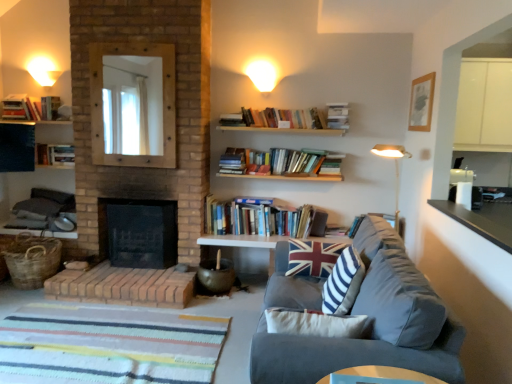
Question: Which direction should I rotate to look at striped fabric pillow at center, placed as the second pillow when sorted from back to front?

Choices:
 (A) left
 (B) right

Answer: (B)

Question: From the image's perspective, is white matte wall sconce at upper left, which appears as the 2th lighting when viewed from the front, under striped fabric pillow at center, acting as the 1th pillow starting from the front?

Choices:
 (A) yes
 (B) no

Answer: (B)

Question: From a real-world perspective, is white matte wall sconce at upper left, which appears as the 2th lighting when viewed from the front, beneath striped fabric pillow at center, placed as the second pillow when sorted from back to front?

Choices:
 (A) yes
 (B) no

Answer: (B)

Question: From the image's perspective, would you say white matte wall sconce at upper left, which ranks as the second lighting in right-to-left order, is positioned over striped fabric pillow at center, acting as the 1th pillow starting from the front?

Choices:
 (A) no
 (B) yes

Answer: (B)

Question: Considering the relative sizes of white matte wall sconce at upper left, which appears as the 2th lighting when viewed from the front, and striped fabric pillow at center, placed as the second pillow when sorted from back to front, in the image provided, is white matte wall sconce at upper left, which appears as the 2th lighting when viewed from the front, wider than striped fabric pillow at center, placed as the second pillow when sorted from back to front,?

Choices:
 (A) no
 (B) yes

Answer: (A)

Question: Does white matte wall sconce at upper left, which ranks as the second lighting in right-to-left order, appear on the left side of striped fabric pillow at center, acting as the 1th pillow starting from the front?

Choices:
 (A) no
 (B) yes

Answer: (B)

Question: Is white matte wall sconce at upper left, which ranks as the second lighting in right-to-left order, smaller than striped fabric pillow at center, acting as the 1th pillow starting from the front?

Choices:
 (A) yes
 (B) no

Answer: (A)

Question: Is hardcover book at upper left, positioned as the 3th book in right-to-left order, a part of woven brown basket at lower left?

Choices:
 (A) no
 (B) yes

Answer: (A)

Question: Is woven brown basket at lower left completely or partially outside of hardcover book at upper left, which is the third book from left to right?

Choices:
 (A) yes
 (B) no

Answer: (A)

Question: Can you confirm if woven brown basket at lower left is positioned to the left of hardcover book at upper left, which is the third book from left to right?

Choices:
 (A) yes
 (B) no

Answer: (B)

Question: Is the position of woven brown basket at lower left less distant than that of hardcover book at upper left, the 5th book ordered from the bottom?

Choices:
 (A) yes
 (B) no

Answer: (A)

Question: Is woven brown basket at lower left looking in the opposite direction of hardcover book at upper left, positioned as the 3th book in right-to-left order?

Choices:
 (A) no
 (B) yes

Answer: (A)

Question: Does woven brown basket at lower left appear on the right side of hardcover book at upper left, positioned as the 3th book in right-to-left order?

Choices:
 (A) yes
 (B) no

Answer: (A)

Question: From a real-world perspective, is velvet gray couch at lower right physically above union jack fabric pillow at center, acting as the 1th pillow starting from the back?

Choices:
 (A) no
 (B) yes

Answer: (A)